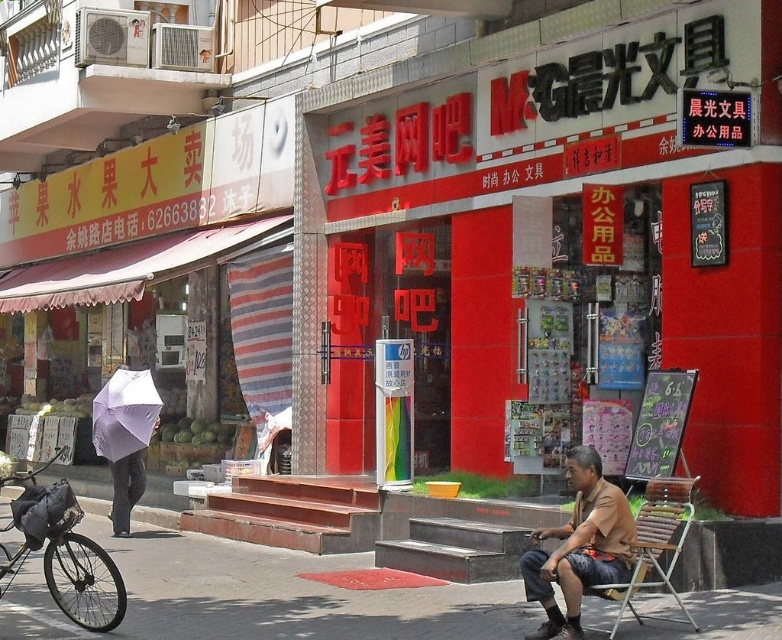
You are a delivery person standing in front of the red storefront with large Chinese characters. You need to place a package on the gray concrete pavement at lower center and the dark gray pants at left. Which location has more space to place the package?

The dark gray pants at left has more space because the gray concrete pavement at lower center is smaller in size compared to it.

You are standing on the gray concrete pavement at lower center and looking up at the dark gray pants at left. Which object is closer to the bottom of the image?

The gray concrete pavement at lower center is closer to the bottom of the image because it is located below the dark gray pants at left.